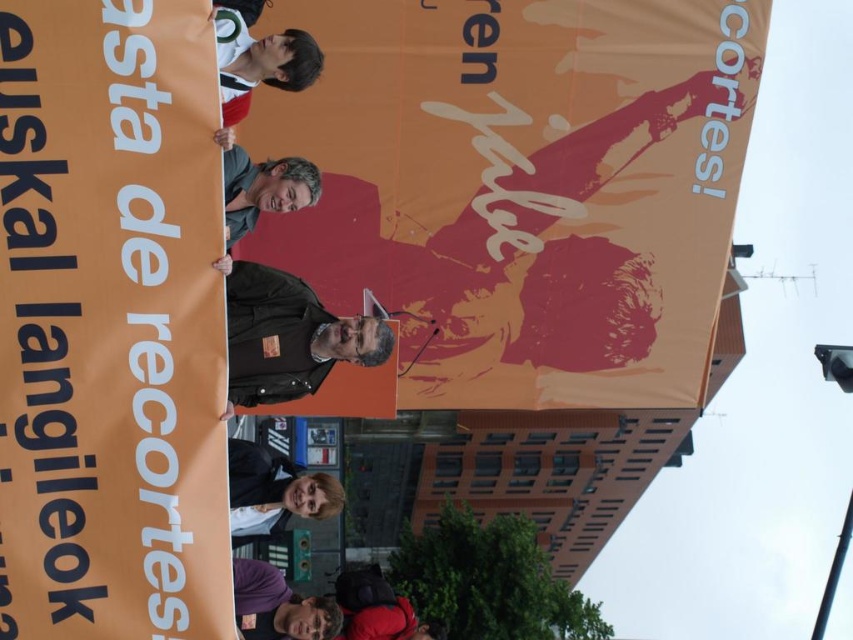
Question: Where is orange fabric banner at upper left located in relation to matte black jacket at center in the image?

Choices:
 (A) left
 (B) right

Answer: (A)

Question: Among these points, which one is nearest to the camera?

Choices:
 (A) pyautogui.click(x=251, y=481)
 (B) pyautogui.click(x=260, y=564)
 (C) pyautogui.click(x=352, y=332)

Answer: (C)

Question: In this image, where is black leather jacket at center located relative to smooth black jacket at lower center?

Choices:
 (A) above
 (B) below

Answer: (A)

Question: Which of the following is the farthest from the observer?

Choices:
 (A) (637, 326)
 (B) (227, 195)
 (C) (264, 330)
 (D) (254, 524)

Answer: (A)

Question: Is orange fabric banner at upper left smaller than black leather jacket at center?

Choices:
 (A) yes
 (B) no

Answer: (B)

Question: Estimate the real-world distances between objects in this image. Which object is farther from the orange fabric banner at upper left?

Choices:
 (A) green jersey at upper left
 (B) purple fabric at lower center
 (C) matte black jacket at center

Answer: (A)